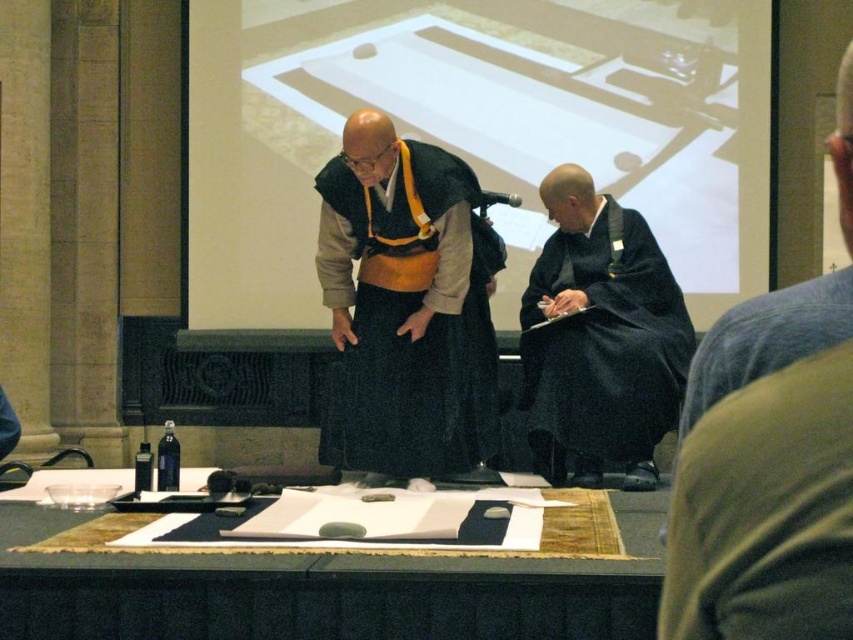
Which is behind, point (624, 611) or point (524, 403)?

Positioned behind is point (524, 403).

Between smooth wooden table at center and black matte robe at center, which one has more height?

black matte robe at center

Where is `smooth wooden table at center`? Image resolution: width=853 pixels, height=640 pixels. smooth wooden table at center is located at coordinates (325, 589).

The image size is (853, 640). What are the coordinates of `smooth wooden table at center` in the screenshot? It's located at click(x=325, y=589).

Does dark blue robe at center appear on the right side of black silk robe at center?

Correct, you'll find dark blue robe at center to the right of black silk robe at center.

Does dark blue robe at center appear under black silk robe at center?

Correct, dark blue robe at center is located below black silk robe at center.

Between point (723, 540) and point (370, 401), which one is positioned behind?

Positioned behind is point (370, 401).

This screenshot has width=853, height=640. I want to click on dark blue robe at center, so click(764, 474).

Does point (740, 403) lie behind point (711, 621)?

Yes.

Between point (820, 608) and point (798, 595), which one is positioned in front?

Point (820, 608) is in front.

Is point (734, 556) farther from viewer compared to point (824, 573)?

Yes.

This screenshot has height=640, width=853. Identify the location of dark blue robe at center. point(764,474).